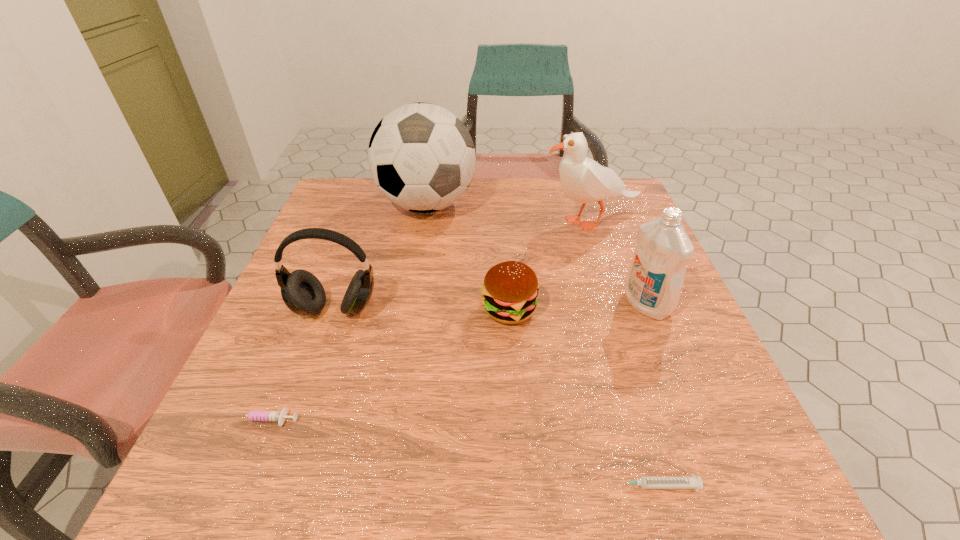
The width and height of the screenshot is (960, 540). What are the coordinates of `vacant position located 0.210m on the main logo of the soccer ball` in the screenshot? It's located at (413, 288).

Locate an element on the screen. blank space located 0.180m at the beak of the gull is located at coordinates pos(470,221).

Where is `vacant space located at the beak of the gull`? The height and width of the screenshot is (540, 960). vacant space located at the beak of the gull is located at coordinates (396, 221).

Identify the location of vacant area situated 0.120m at the beak of the gull. (493, 221).

Where is `vacant space located 0.270m on the back of the detergent`? This screenshot has width=960, height=540. vacant space located 0.270m on the back of the detergent is located at coordinates (612, 219).

This screenshot has height=540, width=960. I want to click on vacant space situated 0.330m on the ear cups of the fourth shortest object, so click(x=272, y=492).

Where is `blank space located on the right of the fourth object from right to left`? blank space located on the right of the fourth object from right to left is located at coordinates (643, 309).

The width and height of the screenshot is (960, 540). Identify the location of free location located on the back of the farther syringe. (320, 276).

In order to click on free spot located at the needle end of the nearest object in this screenshot , I will do `click(577, 485)`.

You are a GUI agent. You are given a task and a screenshot of the screen. Output one action in this format:
    pyautogui.click(x=<x>, y=<y>)
    Task: Click on the free location located at the needle end of the nearest object
    
    Given the screenshot: What is the action you would take?
    pyautogui.click(x=550, y=485)